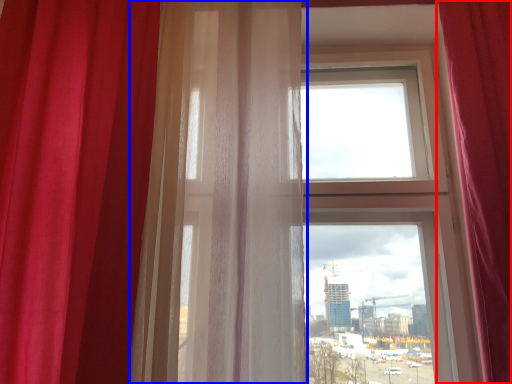
Question: Among these objects, which one is nearest to the camera, curtain (highlighted by a red box) or curtain (highlighted by a blue box)?

Choices:
 (A) curtain
 (B) curtain

Answer: (A)